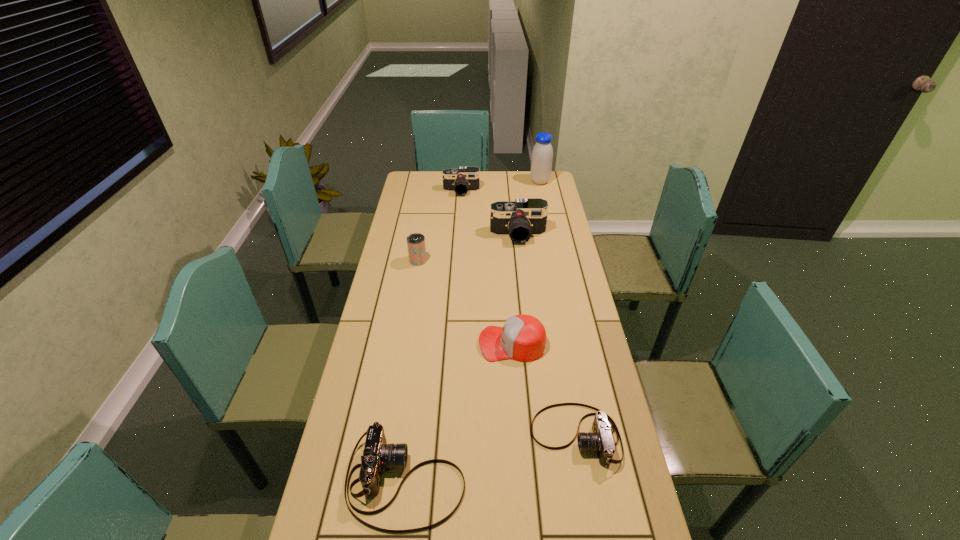
The image size is (960, 540). Find the location of `the second shortest camera`. the second shortest camera is located at coordinates (377, 454).

You are a GUI agent. You are given a task and a screenshot of the screen. Output one action in this format:
    pyautogui.click(x=<x>, y=<y>)
    Task: Click on the bigger brown camera
    This screenshot has height=540, width=960.
    Given the screenshot: What is the action you would take?
    pyautogui.click(x=377, y=454)

At what (x,y) coordinates should I click in order to perform the action: click on the shortest object. Please return your answer as a coordinate pair (x, y). This screenshot has height=540, width=960. Looking at the image, I should click on (601, 440).

Identify the location of the smaller brown camera. (601, 440).

Identify the location of vacant point located 0.090m on the front of the tallest object. The height and width of the screenshot is (540, 960). (542, 196).

This screenshot has width=960, height=540. Find the location of `vacant area situated 0.260m on the front-facing side of the right black camera`. vacant area situated 0.260m on the front-facing side of the right black camera is located at coordinates (524, 287).

This screenshot has height=540, width=960. I want to click on free spot located 0.120m on the front of the beer can, so click(x=414, y=286).

Find the location of a particular element. The image size is (960, 540). vacant space situated 0.110m on the front-facing side of the second tallest camera is located at coordinates (460, 210).

Locate an element on the screen. The image size is (960, 540). vacant area located 0.100m on the front-facing side of the third nearest object is located at coordinates (448, 343).

Locate an element on the screen. vacant space located 0.170m on the front-facing side of the third nearest object is located at coordinates [427, 343].